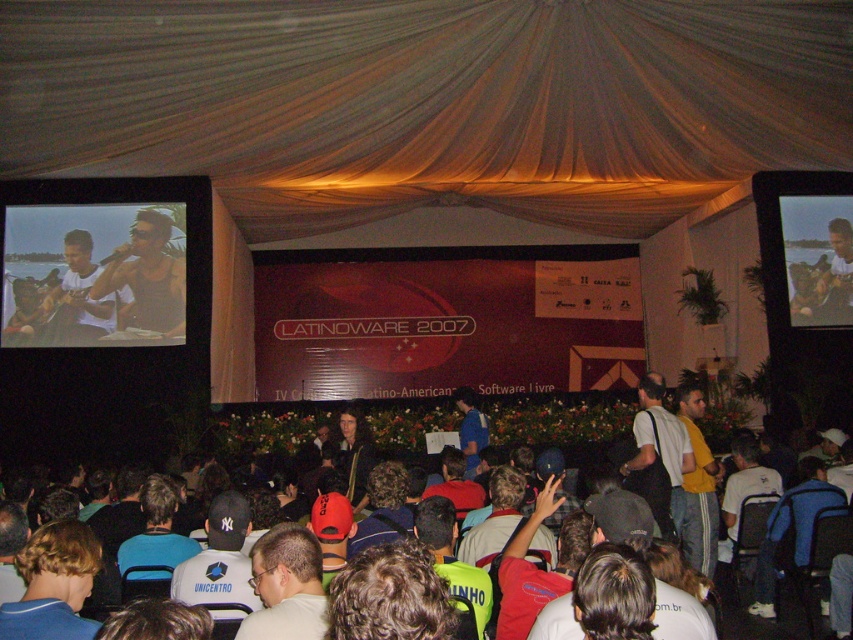
Question: Does matte black laptop at upper left have a lesser width compared to light brown hair at center?

Choices:
 (A) no
 (B) yes

Answer: (A)

Question: Among these objects, which one is farthest from the camera?

Choices:
 (A) dark blue shirt at center
 (B) matte red banner at center
 (C) yellow cotton shirt at right
 (D) dark brown hair at center

Answer: (B)

Question: Is blue shirt at lower left to the left of matte black tank top at upper left from the viewer's perspective?

Choices:
 (A) yes
 (B) no

Answer: (B)

Question: Observing the image, what is the correct spatial positioning of matte red banner at center in reference to white fabric cap at center?

Choices:
 (A) left
 (B) right

Answer: (B)

Question: Which of the following is the farthest from the observer?

Choices:
 (A) dark blue shirt at center
 (B) silky beige curtain at upper center
 (C) matte black laptop at upper left

Answer: (C)

Question: Which of the following is the closest to the observer?

Choices:
 (A) light brown hair at center
 (B) dark brown hair at center

Answer: (B)